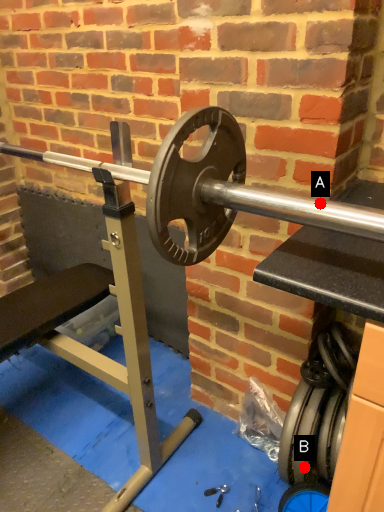
Question: Two points are circled on the image, labeled by A and B beside each circle. Which point is closer to the camera?

Choices:
 (A) A is closer
 (B) B is closer

Answer: (A)